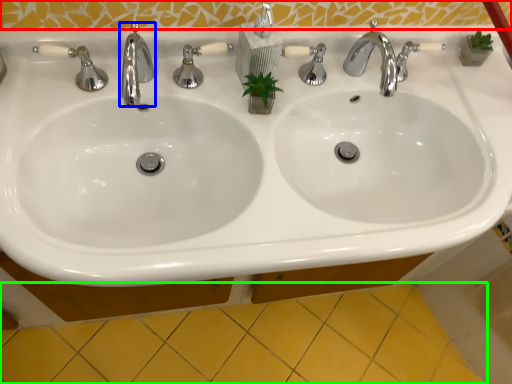
Question: Which object is positioned farthest from mirror (highlighted by a red box)? Select from tap (highlighted by a blue box) and ceramic tile (highlighted by a green box).

Choices:
 (A) tap
 (B) ceramic tile

Answer: (B)